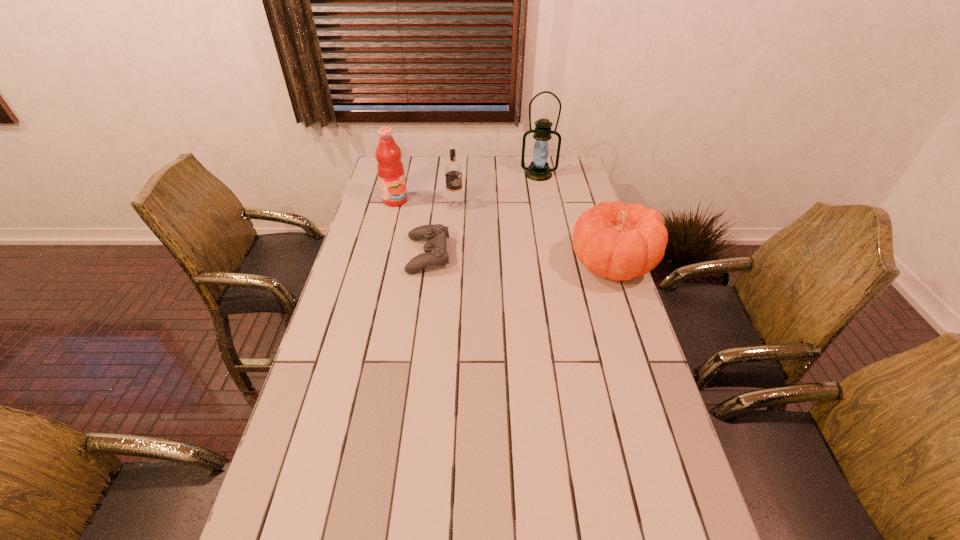
I want to click on the shortest object, so click(x=436, y=235).

Find the location of a particular element. the fourth tallest object is located at coordinates (617, 241).

Identify the location of the second tallest object. (390, 168).

Locate an element on the screen. This screenshot has width=960, height=540. fruit juice is located at coordinates (390, 168).

Locate an element on the screen. This screenshot has height=540, width=960. lantern is located at coordinates (538, 170).

Image resolution: width=960 pixels, height=540 pixels. I want to click on the tallest object, so click(538, 170).

Locate an element on the screen. The height and width of the screenshot is (540, 960). vodka is located at coordinates (453, 171).

Where is `free space located 0.140m on the right of the control`? The height and width of the screenshot is (540, 960). free space located 0.140m on the right of the control is located at coordinates (492, 255).

I want to click on free region located on the front of the pumpkin, so click(x=652, y=385).

Locate an element on the screen. The width and height of the screenshot is (960, 540). vacant space located on the front label of the second tallest object is located at coordinates (459, 228).